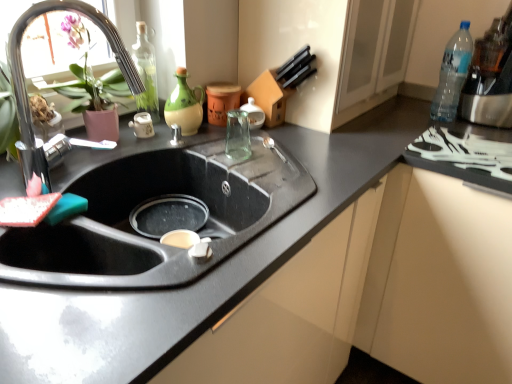
Locate an element on the screen. vacant space in white plastic tray at right (from a real-world perspective) is located at coordinates (457, 152).